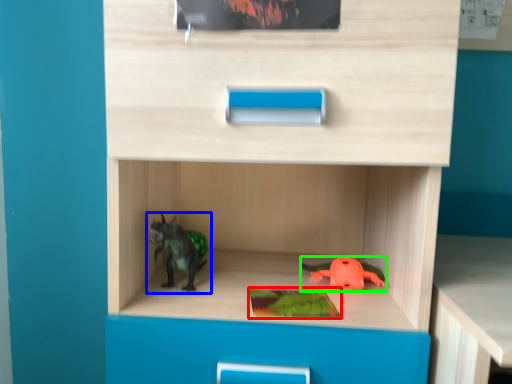
Question: Considering the real-world distances, which object is farthest from paperback book (highlighted by a red box)? toy (highlighted by a blue box) or toy (highlighted by a green box)?

Choices:
 (A) toy
 (B) toy

Answer: (A)